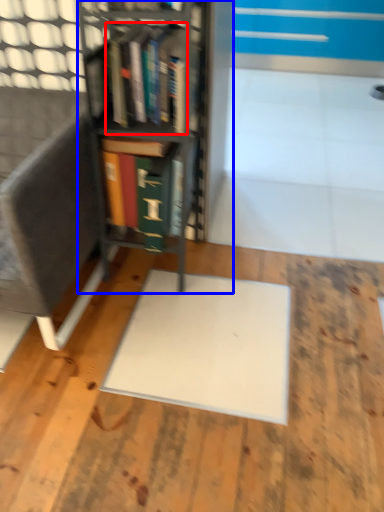
Question: Which object is closer to the camera taking this photo, book (highlighted by a red box) or bookcase (highlighted by a blue box)?

Choices:
 (A) book
 (B) bookcase

Answer: (B)